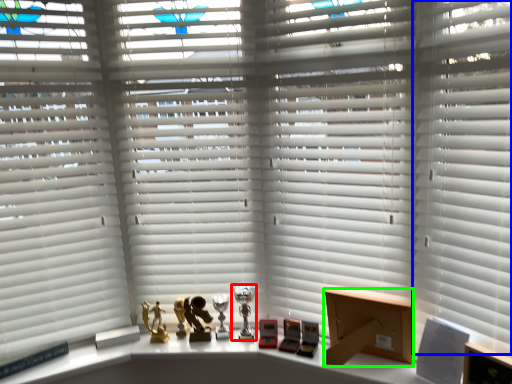
Question: Considering the real-world distances, which object is farthest from table lamp (highlighted by a red box)? shutter (highlighted by a blue box) or cardboard box (highlighted by a green box)?

Choices:
 (A) shutter
 (B) cardboard box

Answer: (A)